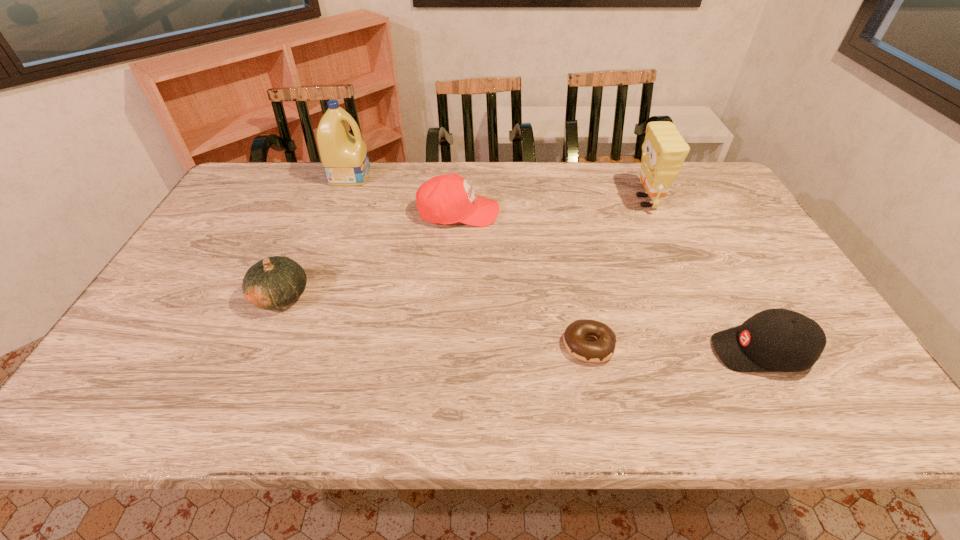
Image resolution: width=960 pixels, height=540 pixels. What are the coordinates of `detergent` in the screenshot? It's located at (344, 157).

At what (x,y) coordinates should I click in order to perform the action: click on sponge. Please return your answer as a coordinate pair (x, y). The image size is (960, 540). Looking at the image, I should click on (664, 150).

Find the location of a particular element. Image resolution: width=960 pixels, height=540 pixels. the fourth object from right to left is located at coordinates click(x=446, y=199).

At what (x,y) coordinates should I click in order to perform the action: click on the farther baseball cap. Please return your answer as a coordinate pair (x, y). The width and height of the screenshot is (960, 540). Looking at the image, I should click on (x=446, y=199).

This screenshot has height=540, width=960. Find the location of `gourd`. gourd is located at coordinates (275, 282).

This screenshot has height=540, width=960. What are the coordinates of `the nearer baseball cap` in the screenshot? It's located at (775, 340).

Identify the location of the right baseball cap. (775, 340).

The width and height of the screenshot is (960, 540). I want to click on the third object from right to left, so click(x=574, y=338).

Locate an element on the screen. The height and width of the screenshot is (540, 960). doughnut is located at coordinates (x=574, y=338).

The width and height of the screenshot is (960, 540). Find the location of `vacant space located on the label of the detergent`. vacant space located on the label of the detergent is located at coordinates (450, 176).